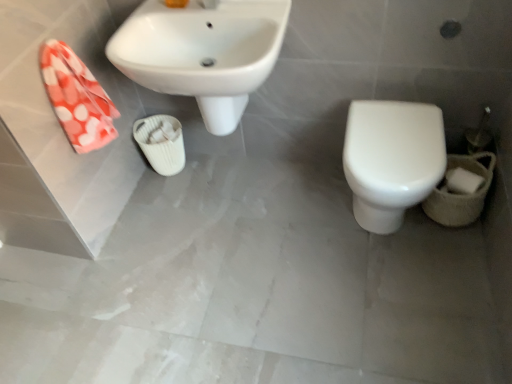
The image size is (512, 384). Identify the location of empty space that is ontop of white glossy toilet at lower right (from a real-world perspective). (396, 133).